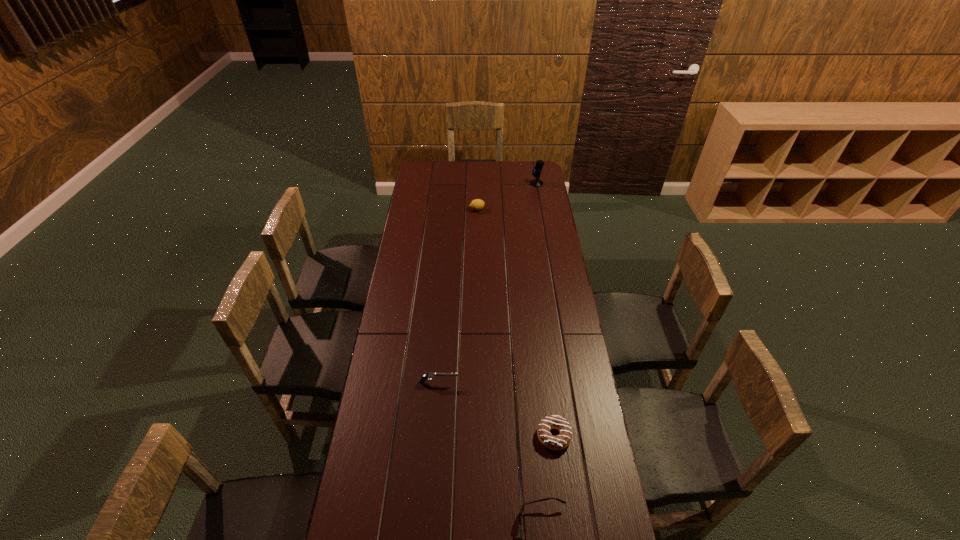
The height and width of the screenshot is (540, 960). Find the location of `the farthest object`. the farthest object is located at coordinates 537,182.

Where is `microphone`? microphone is located at coordinates (537, 182).

Find the location of a particular element. The height and width of the screenshot is (540, 960). the second farthest object is located at coordinates (478, 204).

This screenshot has height=540, width=960. I want to click on the fourth object from right to left, so click(x=478, y=204).

You are a GUI agent. You are given a task and a screenshot of the screen. Output one action in this format:
    pyautogui.click(x=<x>, y=<y>)
    Task: Click on the third nearest object
    Image resolution: width=960 pixels, height=540 pixels.
    Given the screenshot: What is the action you would take?
    pyautogui.click(x=428, y=376)

In order to click on the leftmost object in this screenshot , I will do [x=428, y=376].

Identify the location of doughnut. (561, 441).

The height and width of the screenshot is (540, 960). I want to click on free spot located 0.290m on the stand of the tallest object, so click(482, 184).

At what (x,y) coordinates should I click in order to perform the action: click on vacant space located 0.200m on the stand of the tallest object. Please return your answer as a coordinate pair (x, y). Image resolution: width=960 pixels, height=540 pixels. Looking at the image, I should click on (496, 184).

This screenshot has width=960, height=540. I want to click on free space located on the stand of the tallest object, so click(x=505, y=184).